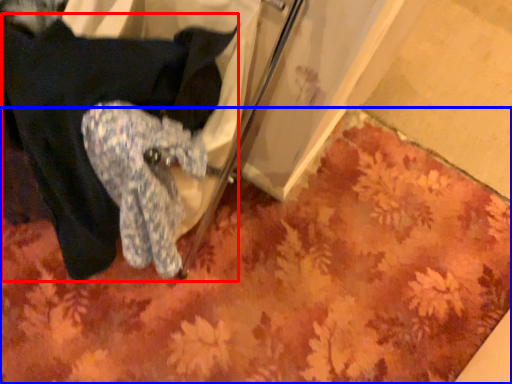
Question: Which object appears closest to the camera in this image, clothing (highlighted by a red box) or mat (highlighted by a blue box)?

Choices:
 (A) clothing
 (B) mat

Answer: (A)